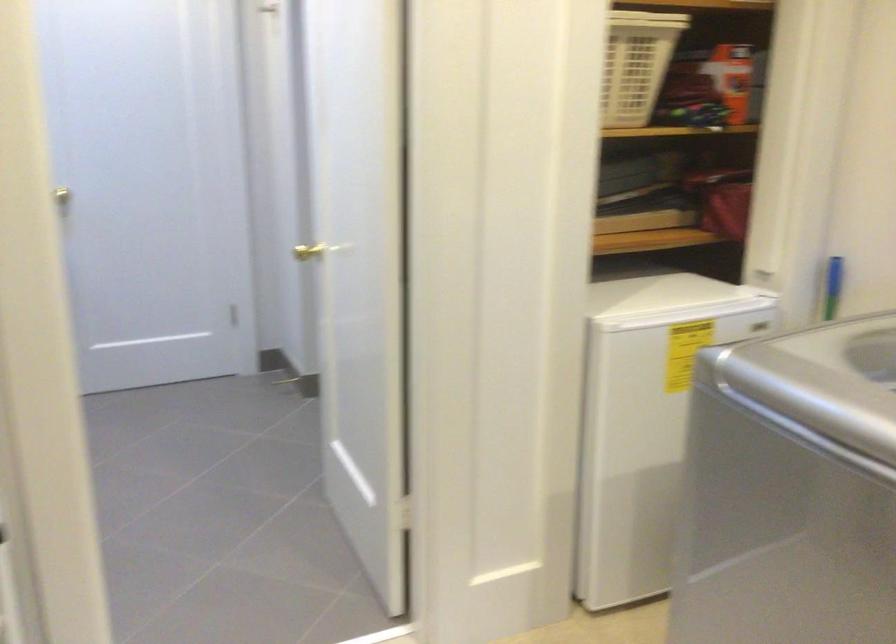
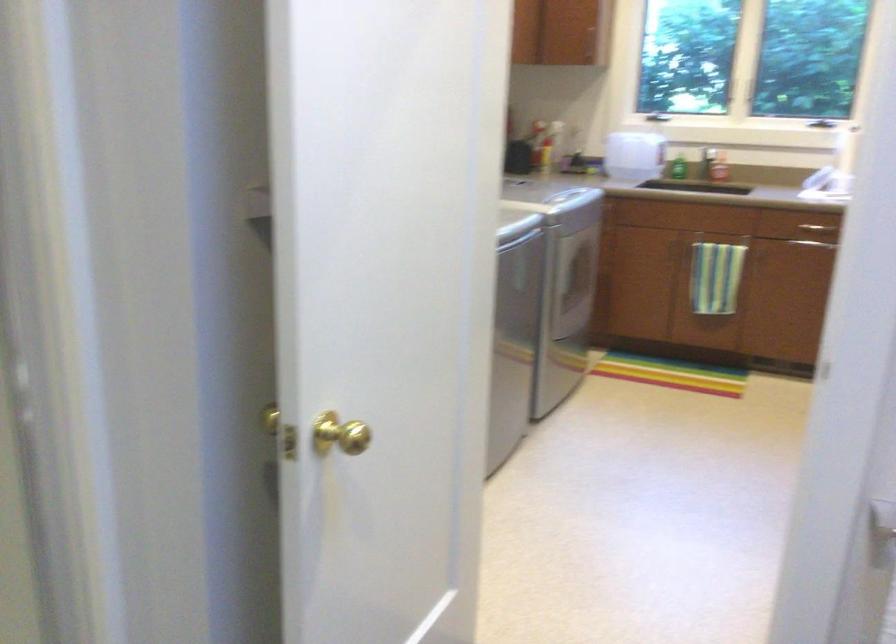
Question: I am providing you with two images of the same scene from different viewpoints. After the viewpoint changes to image2, which objects are now occluded?

Choices:
 (A) large plastic jug
 (B) gold door knob
 (C) round black container
 (D) washing machine lid

Answer: (D)